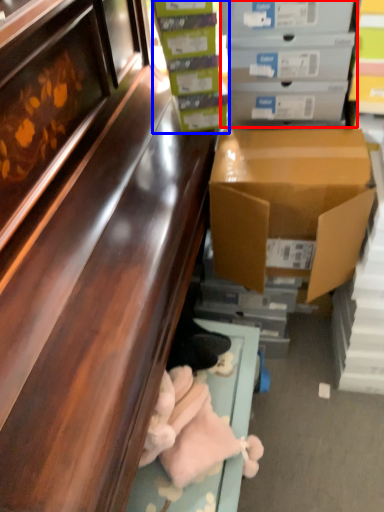
Question: Which of the following is the closest to the observer, box (highlighted by a red box) or box (highlighted by a blue box)?

Choices:
 (A) box
 (B) box

Answer: (A)